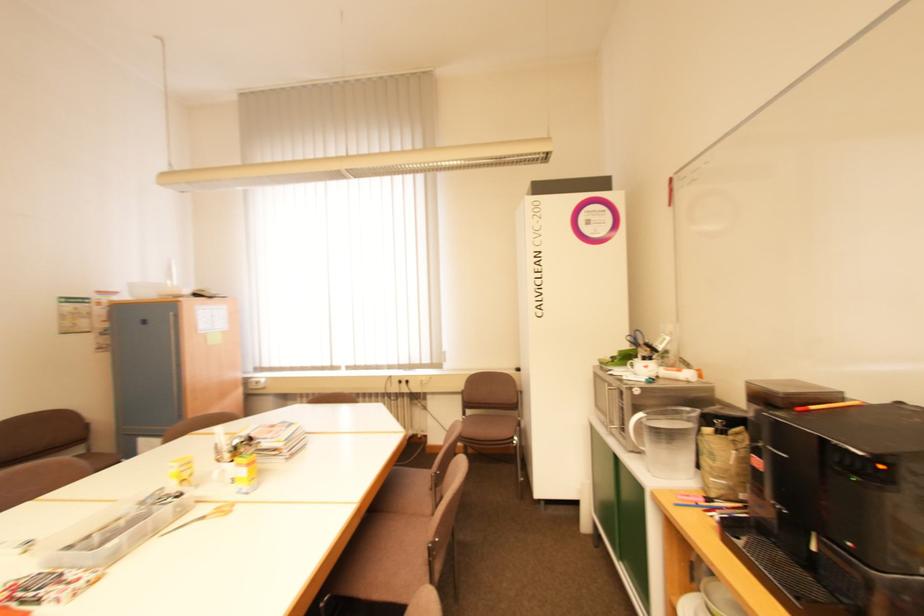
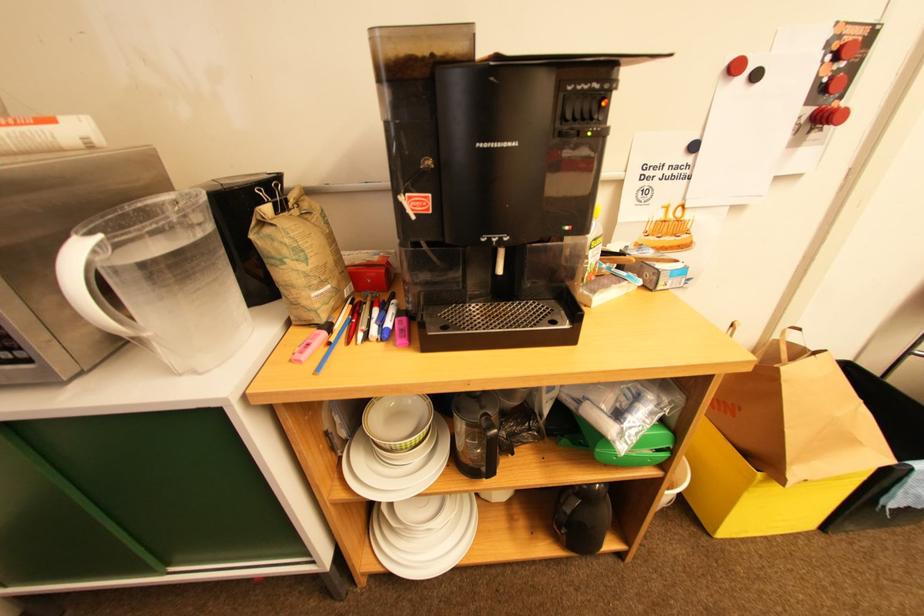
How did the camera likely rotate?

The camera's rotation is toward right-down.